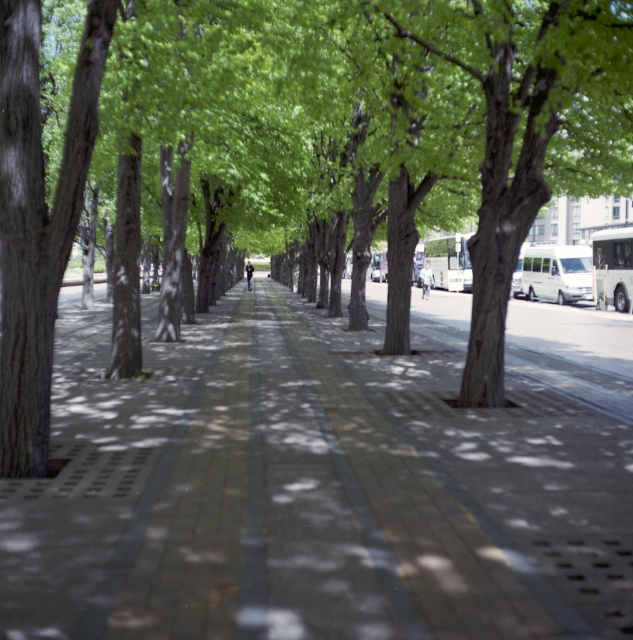
You are a delivery person trying to navigate through the pedestrian walkway. The brick pavement at center is where you need to walk. Considering the height of the brown textured tree at center, will the tree obstruct your path?

The brick pavement at center is not as tall as brown textured tree at center, so the tree will not obstruct your path since it is taller than the pavement.

You are a pedestrian standing on the brick pavement at center. You want to reach the brown textured tree at center. Which direction should you move to get there?

The brick pavement at center is to the left of brown textured tree at center, so you should move to the right to reach the brown textured tree at center.

You are standing at the designated yellow line in the middle of the walkway. Looking straight ahead, where is the brick pavement at center located relative to your current position?

The brick pavement at center is located at point (311, 493) relative to your current position at the yellow line.